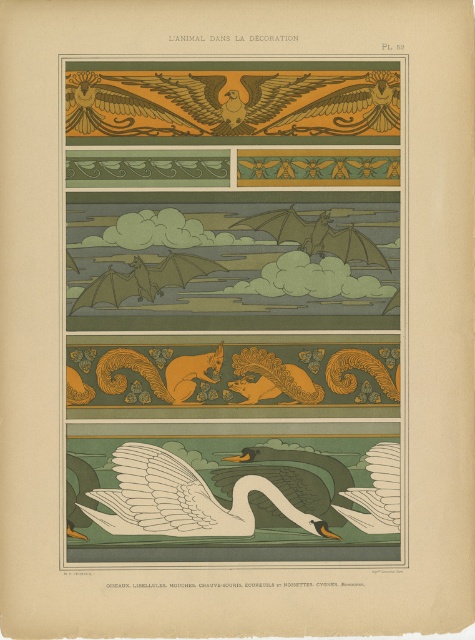
You are an interior designer working on a project that requires placing a camera exactly 4 feet away from the matte gold eagle at upper center. Based on the illustration, will the camera be positioned closer or farther than the current distance of the eagle from the camera?

The matte gold eagle at upper center is currently 4.25 feet from the camera. Placing the camera at 4 feet would position it closer than the current distance.

Looking at the decorative illustration, which object is positioned to the right of the other between the matte gold eagle at upper center and the white matte swan at bottom center?

The matte gold eagle at upper center is to the right of the white matte swan at bottom center.